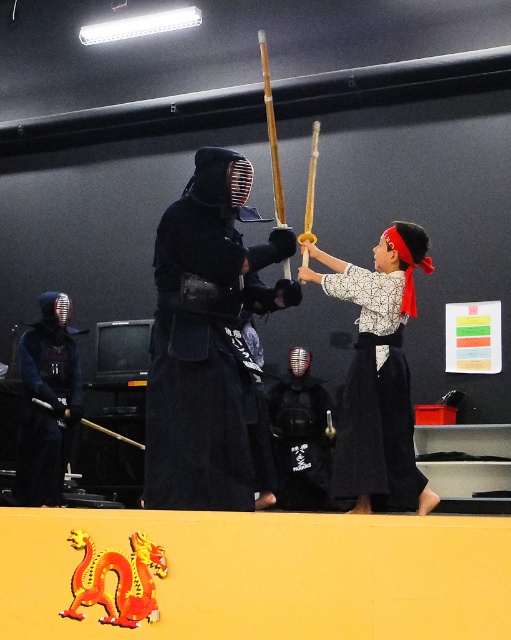
In the scene shown: You are a new student in the dojo and want to approach the black matte kimono at center and the matte black kendo helmet at left. Which object should you walk around to get to the other one?

The black matte kimono at center is in front of the matte black kendo helmet at left. To reach the matte black kendo helmet at left, you should walk around the black matte kimono at center since it is blocking the path directly in front.

You are a photographer setting up for a martial arts event. You need to position a spotlight so it illuminates both the white cotton kimono at center and the matte black kendo helmet at left without causing glare. Given their positions, which object should you aim the spotlight closer to first?

The white cotton kimono at center is in front of the matte black kendo helmet at left, so you should aim the spotlight closer to the white cotton kimono at center first to ensure both are illuminated properly.